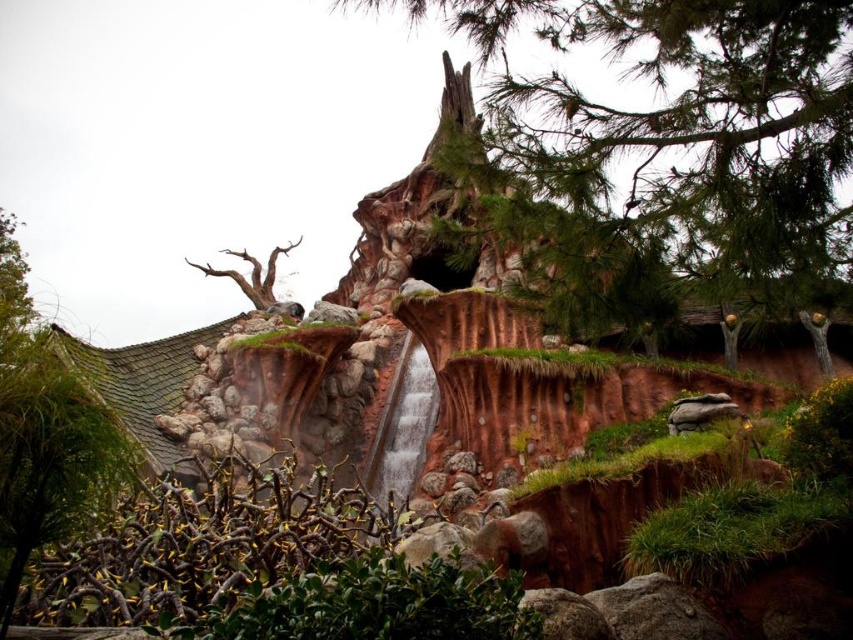
Is green mossy roof at left below bare wood tree at upper left?

Yes, green mossy roof at left is below bare wood tree at upper left.

Is green mossy roof at left above bare wood tree at upper left?

No.

This screenshot has height=640, width=853. I want to click on green mossy roof at left, so click(44, 433).

Find the location of a particular element. green mossy roof at left is located at coordinates (44, 433).

Is the position of rough bark tree at center more distant than that of bare wood tree at upper left?

That is False.

Where is `rough bark tree at center`? rough bark tree at center is located at coordinates (677, 150).

Find the location of a particular element. rough bark tree at center is located at coordinates pos(677,150).

Does rough bark tree at center have a lesser width compared to green mossy roof at left?

Yes.

What do you see at coordinates (677, 150) in the screenshot?
I see `rough bark tree at center` at bounding box center [677, 150].

At what (x,y) coordinates should I click in order to perform the action: click on rough bark tree at center. Please return your answer as a coordinate pair (x, y). The width and height of the screenshot is (853, 640). Looking at the image, I should click on (677, 150).